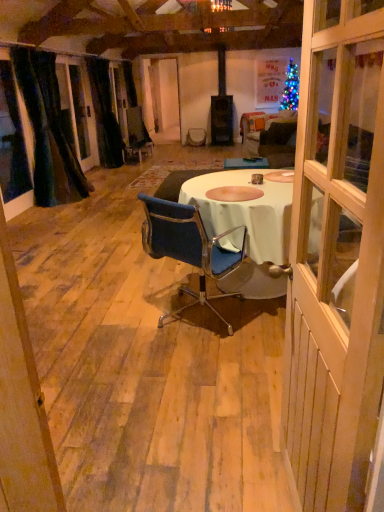
Where is `blank space to the left of blue fabric chair at center`? The width and height of the screenshot is (384, 512). blank space to the left of blue fabric chair at center is located at coordinates (111, 322).